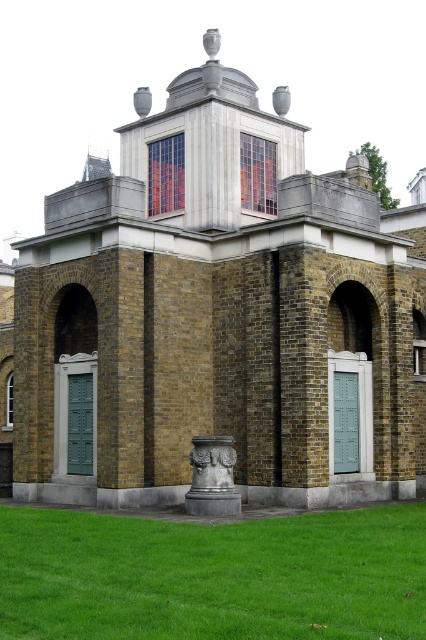
Can you confirm if green grass at lower center is positioned above dark gray stone column at center?

Actually, green grass at lower center is below dark gray stone column at center.

Which is behind, point (55, 582) or point (192, 512)?

Positioned behind is point (192, 512).

Identify the location of green grass at lower center. This screenshot has height=640, width=426. (213, 577).

Locate an element on the screen. green grass at lower center is located at coordinates (213, 577).